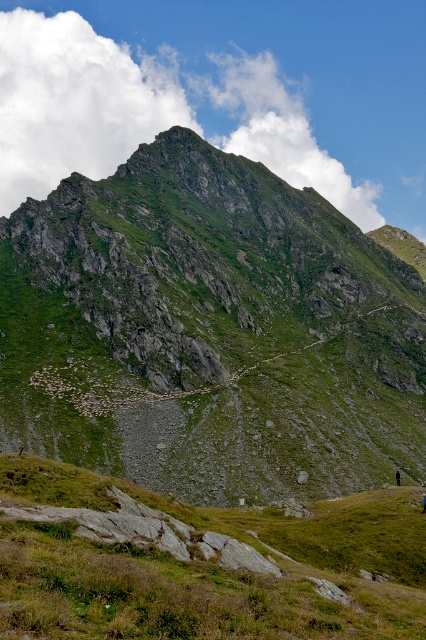
You are a hiker trying to reach the summit of the green rocky mountain at center. Based on the image, what is the approximate 2D coordinate of the mountain to guide your navigation?

The 2D coordinate of the green rocky mountain at center is approximately at point (209, 332).

Looking at this image, you are a hiker planning to climb the mountain. You see the green rocky mountain at center and the green grassy at lower center. Which area is higher in elevation?

The green rocky mountain at center is higher in elevation than the green grassy at lower center because it is positioned above it.